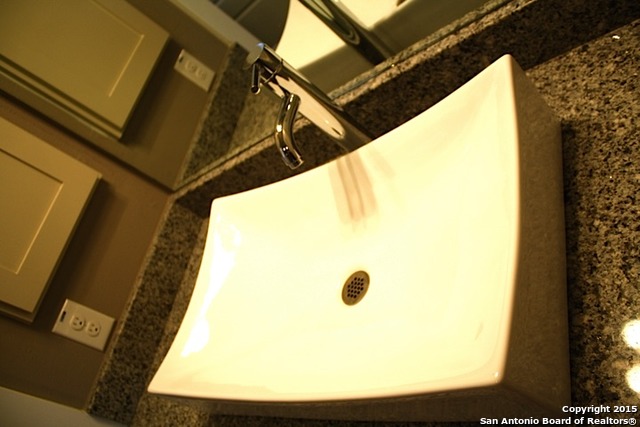
Image resolution: width=640 pixels, height=427 pixels. What are the coordinates of `bathroom counter` in the screenshot? It's located at click(x=611, y=228).